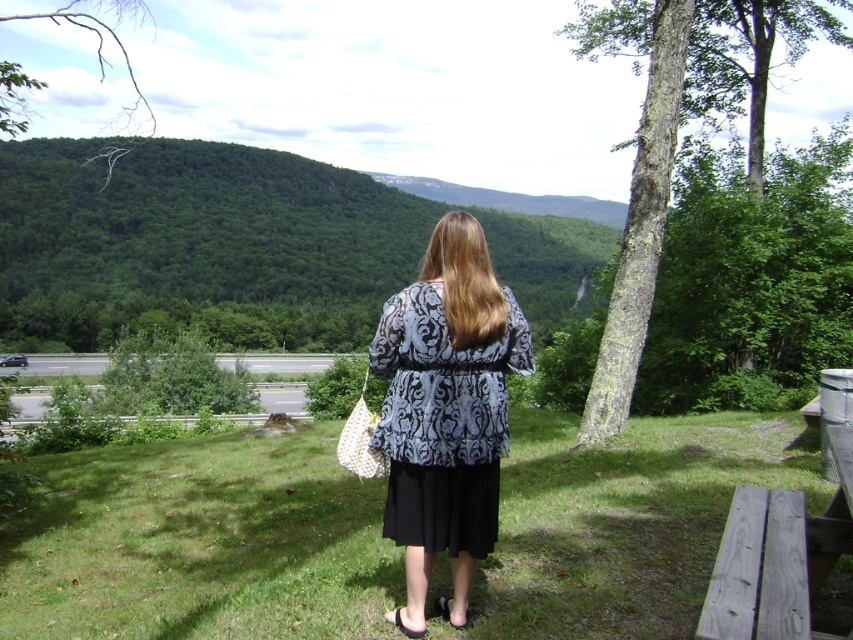
You are taking a photo of the person in the scene. The camera is positioned at the same level as the person. You want to focus on both the person and the distant hillside. Which point, point (552,481) or point (445,406), should you adjust the focus to ensure both are in sharp detail?

You should adjust the focus to point (552,481) because it is closer to the camera than point (445,406), allowing for a greater depth of field to include both the person and the distant hillside in sharp detail.

You are a photographer planning to take a picture of the scene. You want to ensure that both the green grass at center and the patterned fabric dress at center are clearly visible. Which object should you focus on to ensure proper exposure, and why?

You should focus on the green grass at center because it is larger in size than the patterned fabric dress at center, making it easier to adjust the exposure settings for the overall scene.